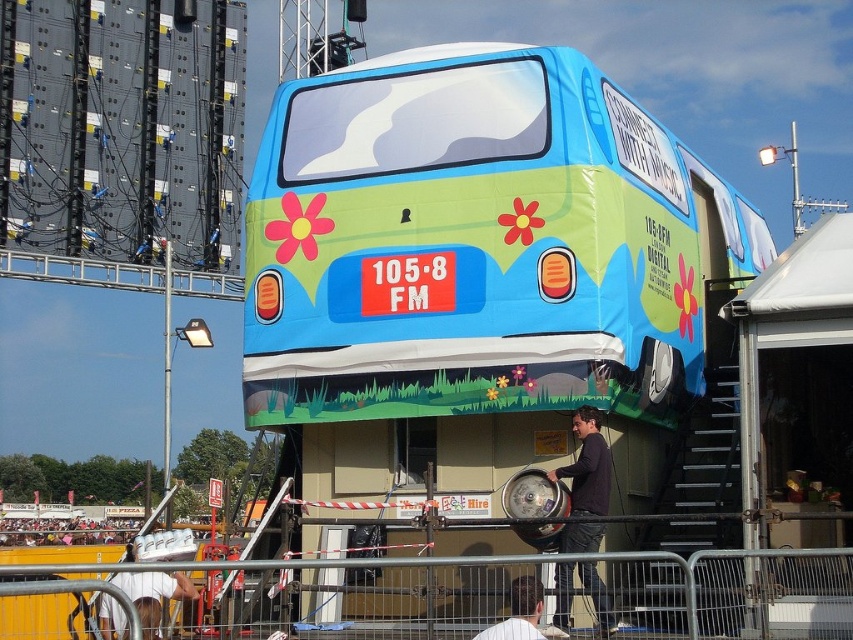
You are a photographer standing in front of the bus and see the dark brown leather jacket at lower center and the white shirt at lower center. Which one is closer to you?

The dark brown leather jacket at lower center is closer to you because it is further to the viewer than the white shirt at lower center.

From the picture: You are a photographer at the event and want to capture both the metal at lower center and the white fabric at lower left in the same frame. Since you can only focus on one object, which one should you choose to ensure the other is still visible in the background?

The metal at lower center is bigger than the white fabric at lower left, so you should focus on the metal at lower center to ensure the smaller white fabric at lower left remains visible in the background.